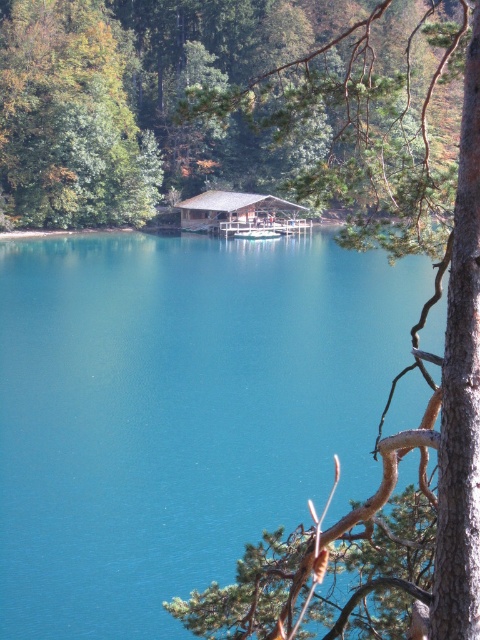
Which is more to the right, teal glossy water at center or green pine branch at upper center?

green pine branch at upper center is more to the right.

Does point (240, 513) come in front of point (362, 616)?

No, it is not.

This screenshot has width=480, height=640. Find the location of `teal glossy water at center`. teal glossy water at center is located at coordinates (180, 412).

Identify the location of teal glossy water at center. (180, 412).

Can you confirm if green leafy tree at upper left is shorter than brown wooden hut at center?

In fact, green leafy tree at upper left may be taller than brown wooden hut at center.

Is green leafy tree at upper left to the right of brown wooden hut at center from the viewer's perspective?

In fact, green leafy tree at upper left is to the left of brown wooden hut at center.

What do you see at coordinates (70, 122) in the screenshot?
I see `green leafy tree at upper left` at bounding box center [70, 122].

The width and height of the screenshot is (480, 640). Find the location of `green leafy tree at upper left`. green leafy tree at upper left is located at coordinates pyautogui.click(x=70, y=122).

Can you confirm if green pine branch at upper center is positioned below brown wooden hut at center?

No.

Is green pine branch at upper center to the left of brown wooden hut at center from the viewer's perspective?

No, green pine branch at upper center is not to the left of brown wooden hut at center.

Who is more forward, [375,528] or [273,220]?

Point [375,528]

Identify the location of green pine branch at upper center. (396, 376).